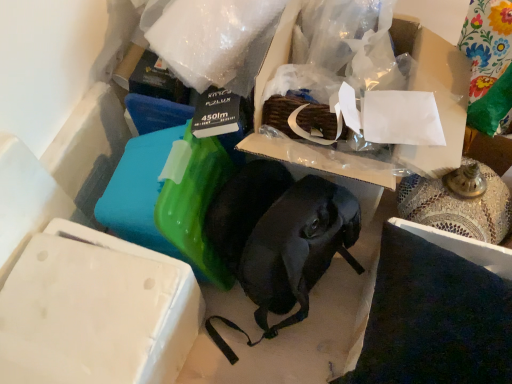
Locate an element on the screen. white matte box at lower left is located at coordinates [96, 311].

The width and height of the screenshot is (512, 384). What do you see at coordinates (96, 311) in the screenshot? I see `white matte box at lower left` at bounding box center [96, 311].

The width and height of the screenshot is (512, 384). I want to click on matte cardboard box at center, so click(x=434, y=95).

Image resolution: width=512 pixels, height=384 pixels. What do you see at coordinates (434, 95) in the screenshot? I see `matte cardboard box at center` at bounding box center [434, 95].

This screenshot has height=384, width=512. Find the location of `white matte box at lower left`. white matte box at lower left is located at coordinates (96, 311).

In the scene shown: Between white matte box at lower left and matte cardboard box at center, which one appears on the right side from the viewer's perspective?

matte cardboard box at center is more to the right.

Does white matte box at lower left come behind matte cardboard box at center?

No, it is in front of matte cardboard box at center.

Between point (97, 340) and point (458, 141), which one is positioned in front?

The point (97, 340) is closer.

From the image's perspective, is white matte box at lower left positioned above or below matte cardboard box at center?

Clearly, from the image's perspective, white matte box at lower left is below matte cardboard box at center.

From a real-world perspective, who is located lower, white matte box at lower left or matte cardboard box at center?

In real-world perspective, white matte box at lower left is lower.

Which object is wider, white matte box at lower left or matte cardboard box at center?

matte cardboard box at center is wider.

Is white matte box at lower left taller than matte cardboard box at center?

No, white matte box at lower left is not taller than matte cardboard box at center.

Which of these two, white matte box at lower left or matte cardboard box at center, is smaller?

With smaller size is white matte box at lower left.

Is white matte box at lower left not inside matte cardboard box at center?

Yes, white matte box at lower left is outside of matte cardboard box at center.

Is white matte box at lower left placed right next to matte cardboard box at center?

No, white matte box at lower left is not next to matte cardboard box at center.

Is matte cardboard box at center at the back of white matte box at lower left?

No.

What's the angular difference between white matte box at lower left and matte cardboard box at center's facing directions?

The angular difference between white matte box at lower left and matte cardboard box at center is 87.7 degrees.

You are a GUI agent. You are given a task and a screenshot of the screen. Output one action in this format:
    pyautogui.click(x=<x>, y=<y>)
    Task: Click on the box located on the left of matte cardboard box at center
    The image size is (512, 384).
    Given the screenshot: What is the action you would take?
    pyautogui.click(x=96, y=311)

Which object is positioned more to the left, matte cardboard box at center or white matte box at lower left?

white matte box at lower left.

Considering their positions, is matte cardboard box at center located in front of or behind white matte box at lower left?

matte cardboard box at center is positioned farther from the viewer than white matte box at lower left.

Based on the photo, which point is more distant from viewer, [398,25] or [90,321]?

Point [398,25]

From the image's perspective, is matte cardboard box at center below white matte box at lower left?

No, from the image's perspective, matte cardboard box at center is not beneath white matte box at lower left.

From a real-world perspective, is matte cardboard box at center above or below white matte box at lower left?

Clearly, from a real-world perspective, matte cardboard box at center is above white matte box at lower left.

Can you confirm if matte cardboard box at center is wider than white matte box at lower left?

Yes.

Is matte cardboard box at center shorter than white matte box at lower left?

Incorrect, the height of matte cardboard box at center does not fall short of that of white matte box at lower left.

Can you confirm if matte cardboard box at center is smaller than white matte box at lower left?

No, matte cardboard box at center is not smaller than white matte box at lower left.

Can white matte box at lower left be found inside matte cardboard box at center?

That's incorrect, white matte box at lower left is not inside matte cardboard box at center.

Consider the image. Is matte cardboard box at center far away from white matte box at lower left?

matte cardboard box at center is actually quite close to white matte box at lower left.

Is matte cardboard box at center oriented away from white matte box at lower left?

No, matte cardboard box at center's orientation is not away from white matte box at lower left.

How distant is matte cardboard box at center from white matte box at lower left?

matte cardboard box at center and white matte box at lower left are 23.35 inches apart.

Image resolution: width=512 pixels, height=384 pixels. Find the location of `storage box behind the white matte box at lower left`. storage box behind the white matte box at lower left is located at coordinates (434, 95).

At what (x,y) coordinates should I click in order to perform the action: click on box located on the left of matte cardboard box at center. Please return your answer as a coordinate pair (x, y). Image resolution: width=512 pixels, height=384 pixels. Looking at the image, I should click on (96, 311).

Locate an element on the screen. box in front of the matte cardboard box at center is located at coordinates [96, 311].